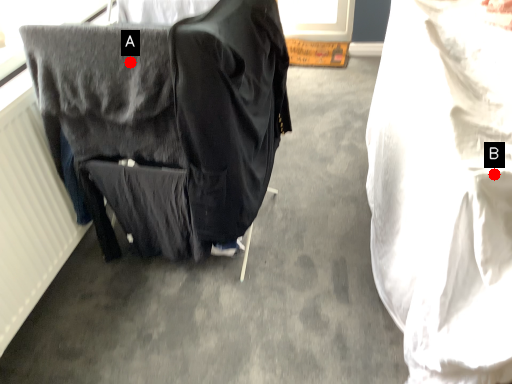
Question: Two points are circled on the image, labeled by A and B beside each circle. Which point is closer to the camera taking this photo?

Choices:
 (A) A is closer
 (B) B is closer

Answer: (B)